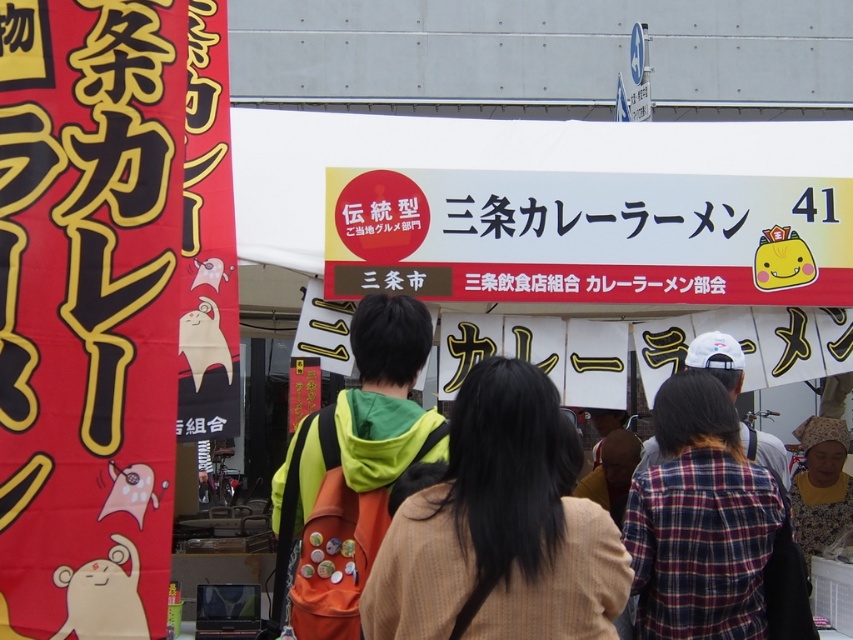
Question: Which point is closer to the camera taking this photo?

Choices:
 (A) (549, 250)
 (B) (509, 508)
 (C) (309, 465)

Answer: (B)

Question: Which point is farther to the camera?

Choices:
 (A) plaid fabric shirt at center
 (B) white paper sign at center
 (C) red paper banner at left
 (D) brown textured coat at center

Answer: (B)

Question: Does white paper sign at center lie in front of brown textured coat at center?

Choices:
 (A) no
 (B) yes

Answer: (A)

Question: Can you confirm if brown textured coat at center is smaller than green fabric jacket at center?

Choices:
 (A) no
 (B) yes

Answer: (B)

Question: Estimate the real-world distances between objects in this image. Which object is closer to the white paper sign at center?

Choices:
 (A) red paper banner at left
 (B) brown textured coat at center
 (C) plaid fabric shirt at center

Answer: (C)

Question: Can you confirm if red paper banner at left is wider than plaid fabric shirt at center?

Choices:
 (A) no
 (B) yes

Answer: (A)